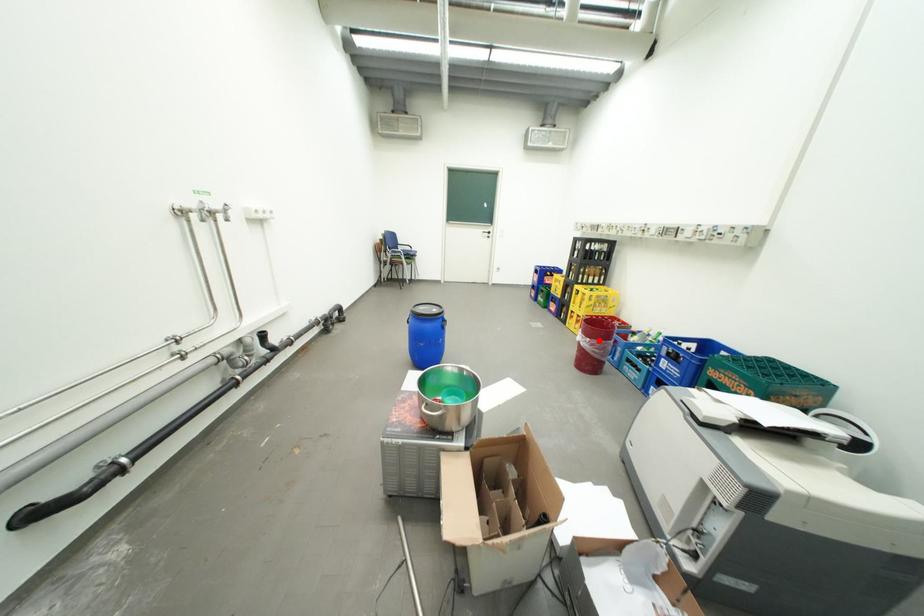
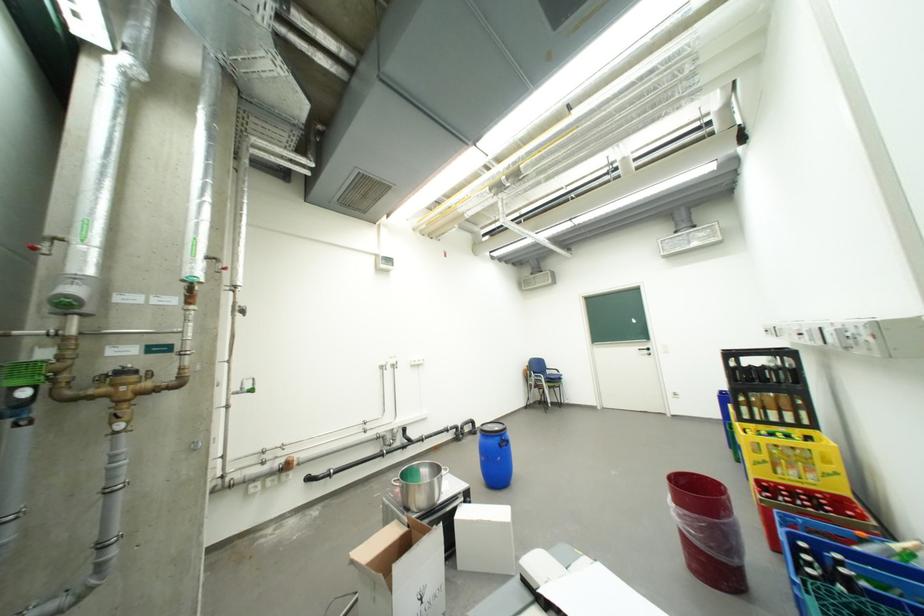
In the second image, find the point that corresponds to the highlighted location in the first image.

(685, 507)